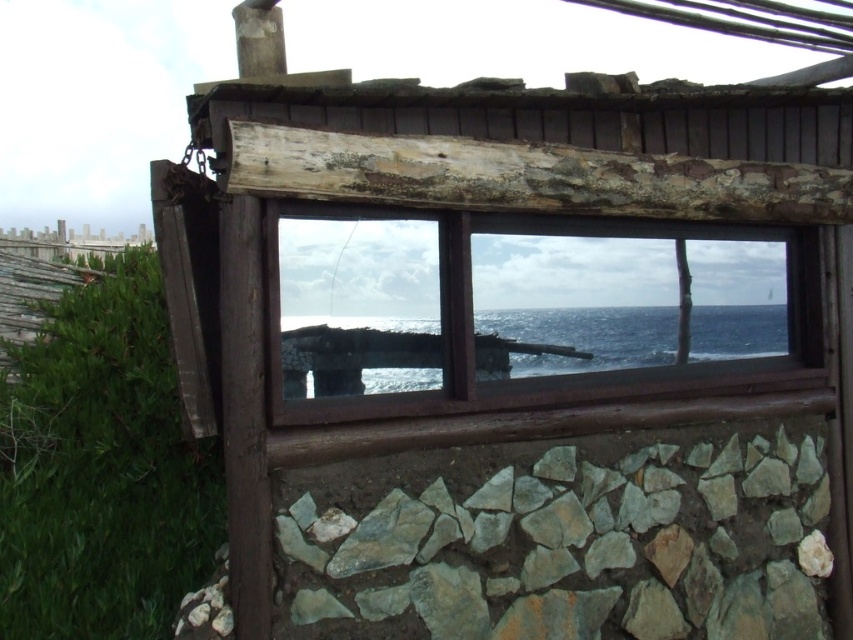
You are standing in front of the rustic wooden structure and want to determine the relative positions of two points marked in the image. Which point, point (392, 545) or point (666, 364), is closer to you?

Point (392, 545) is closer to you than point (666, 364).

You are standing at the camera position in the coastal structure. There is a gray rough stone at lower center that you want to reach. Can you walk directly to it without moving any objects?

The gray rough stone at lower center is 10.81 feet away from the camera position. Since there is no mention of obstacles in the scene description, you can walk directly to it without moving any objects.

In the scene shown: You are standing inside the rustic wooden structure and want to place a small potted plant on the floor. The potted plant needs to be placed to the left of the brown wooden window frame at center. Is there space available for the plant at the gray rough stone at lower center?

The gray rough stone at lower center is to the right of the brown wooden window frame at center, so placing the potted plant there would not satisfy the requirement of being to the left of the brown wooden window frame at center. You should look for another location to the left side of the brown wooden window frame at center.